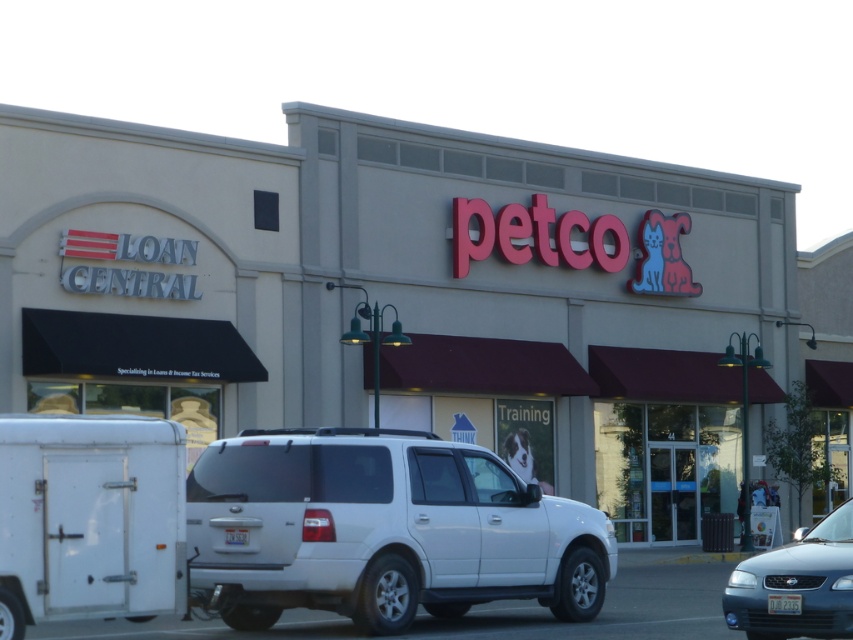
You are a delivery driver who needs to park your truck between the white matte minivan at center and the metallic blue sedan at lower right. Your truck is 5 meters long. Is there enough space between them to park?

The distance between the white matte minivan at center and the metallic blue sedan at lower right is 4.82 meters. Since your truck is 5 meters long, there isn not enough space to park between them.

You are driving a delivery truck and need to back up into the parking space behind the white matte minivan at center and the white matte trailer at lower left. Which vehicle should you move first to ensure there is enough space?

The white matte trailer at lower left is behind the white matte minivan at center, so you should move the white matte trailer at lower left first to create space for the delivery truck to back into the parking area.

You are a delivery driver who needs to park your white matte minivan at center in a spot that is closest to the Loan Central storefront. Based on the image, can you determine whether the minivan should be parked closer to the left side or the right side of the building?

The white matte minivan at center is positioned at point (x=381, y=529), so it should be parked closer to the right side of the building to be nearest to the Loan Central storefront.